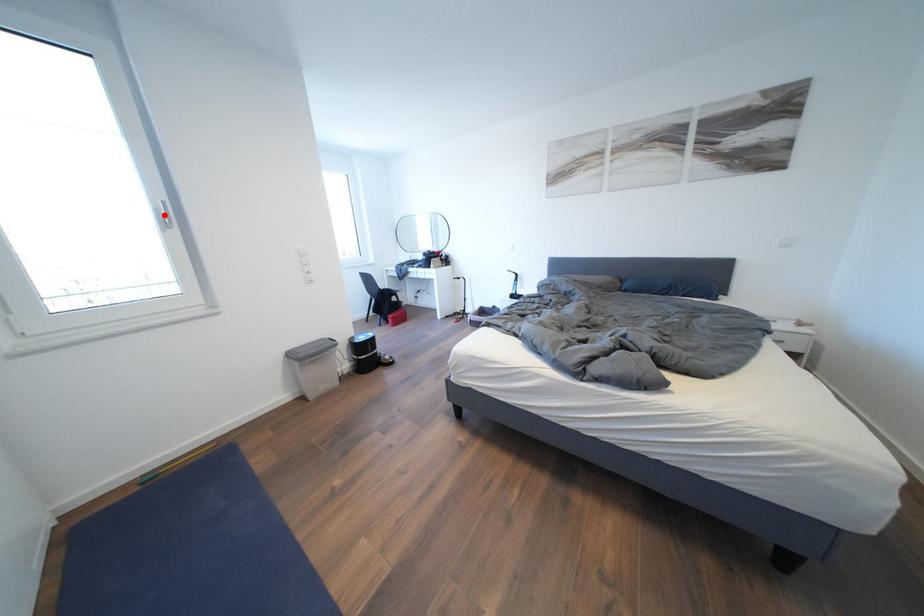
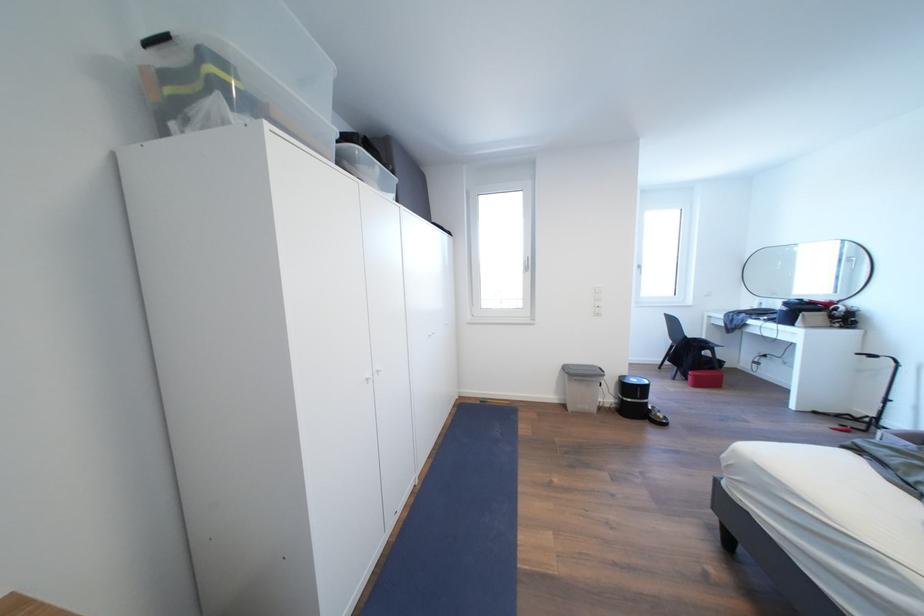
Locate, in the second image, the point that corresponds to the highlighted location in the first image.

(532, 267)